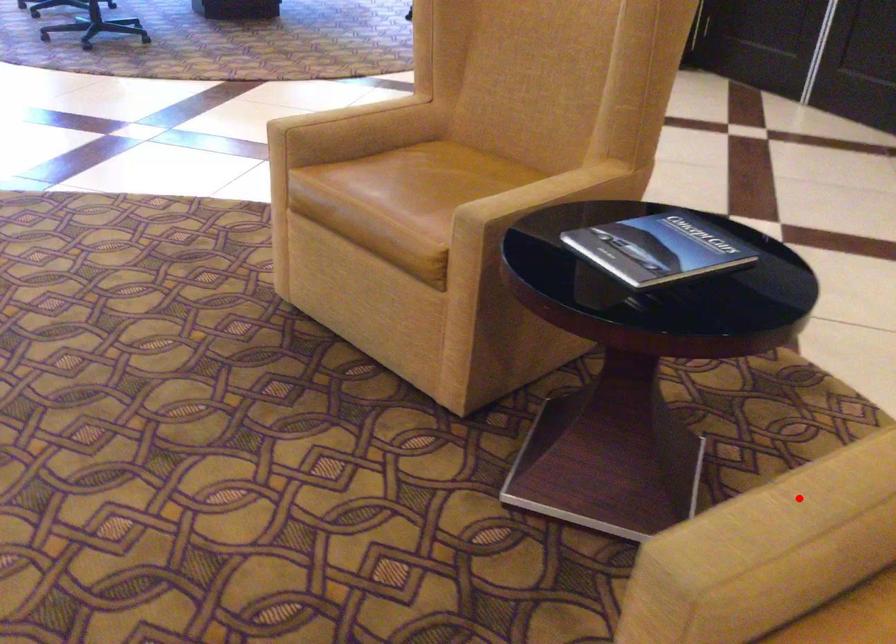
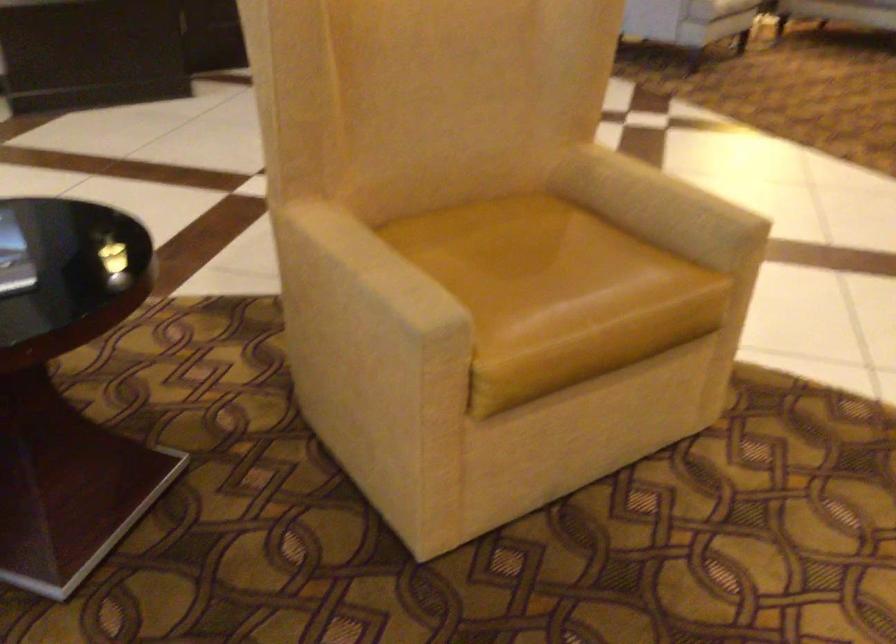
Find the pixel in the second image that matches the highlighted location in the first image.

(375, 266)